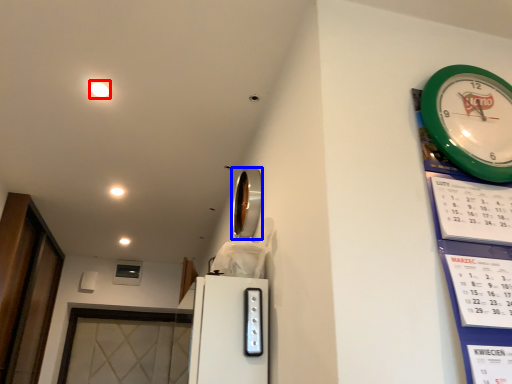
Question: Among these objects, which one is farthest to the camera, light (highlighted by a red box) or mirror (highlighted by a blue box)?

Choices:
 (A) light
 (B) mirror

Answer: (A)